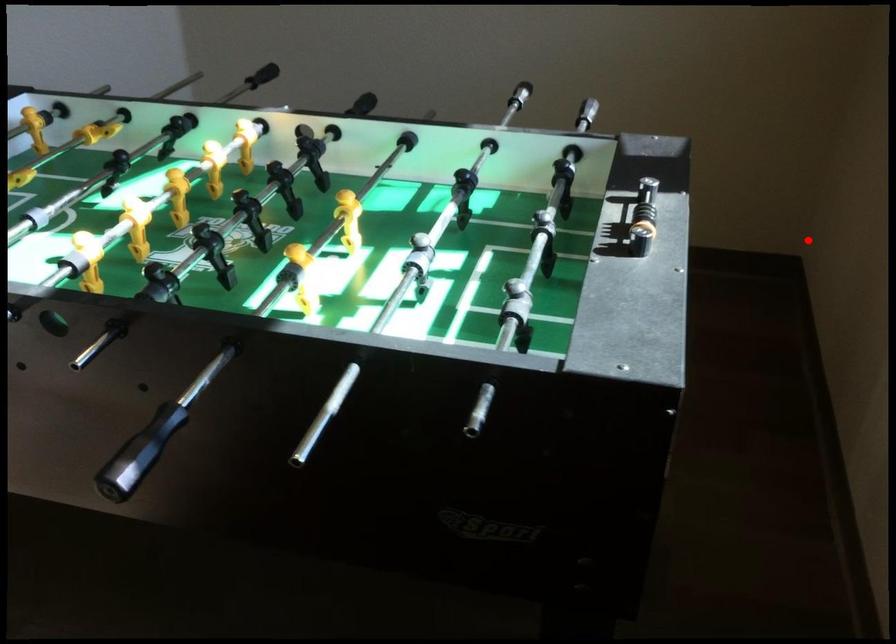
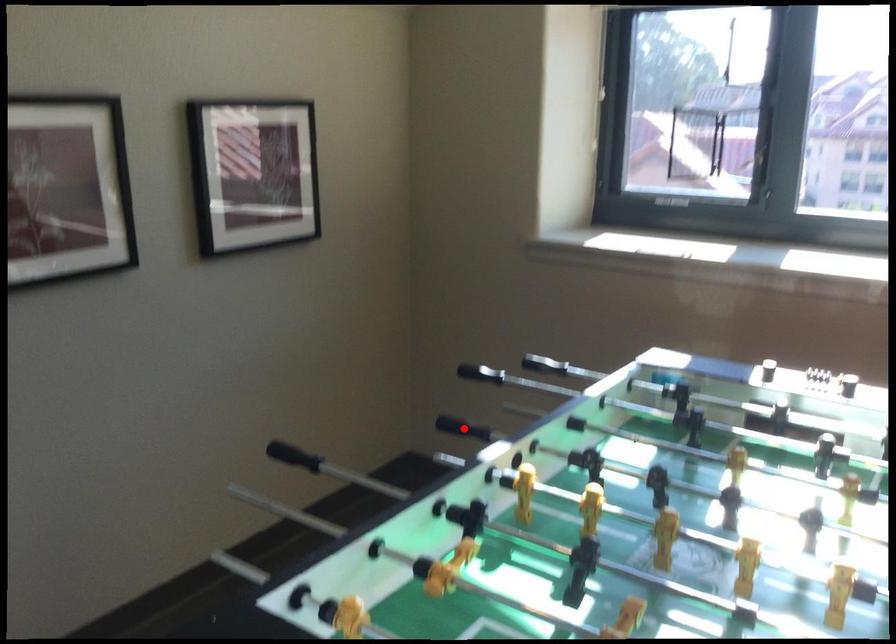
I am providing you with two images of the same scene from different viewpoints. A red point is marked on the first image and another point is marked on the second image. Are the points marked in image1 and image2 representing the same 3D position?

Yes